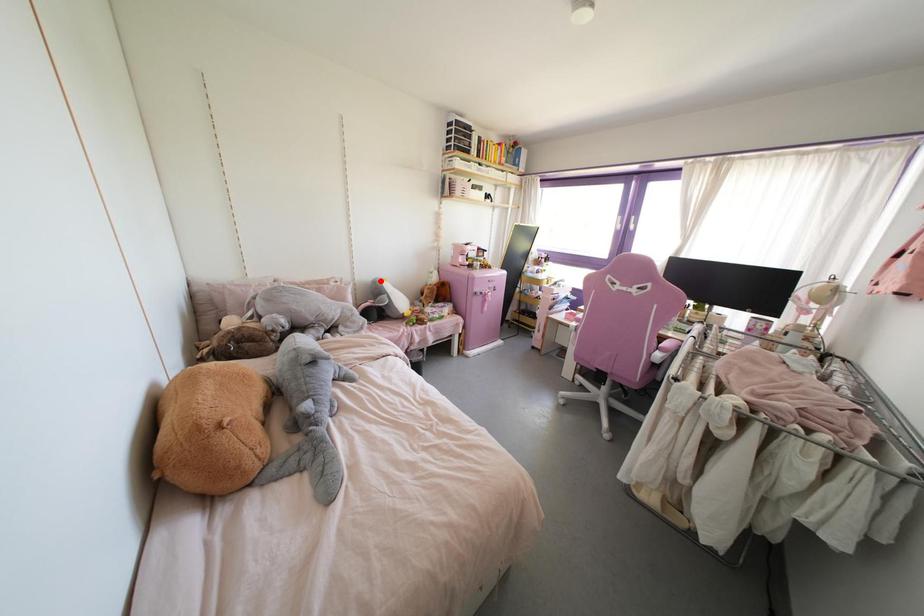
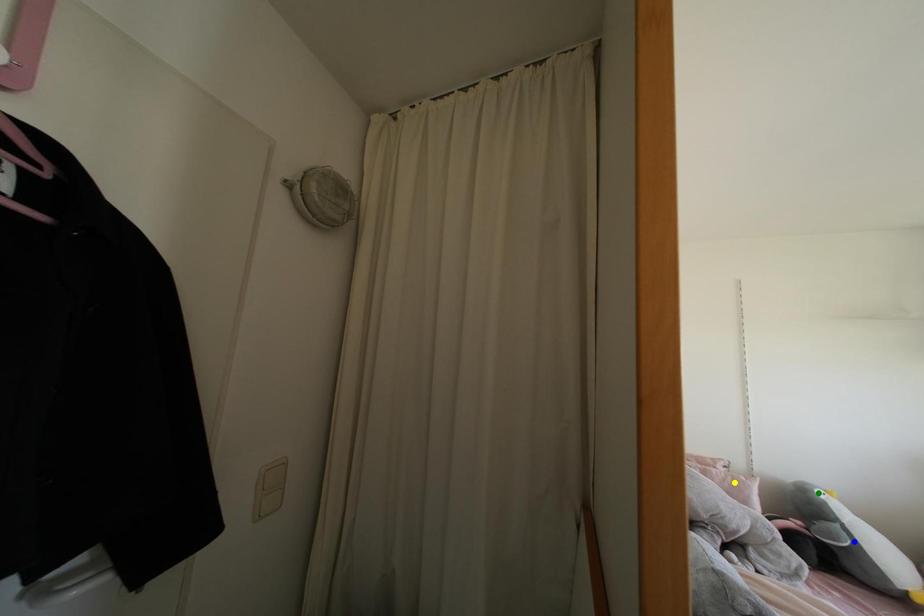
Question: I am providing you with two images of the same scene from different viewpoints. A red point is marked on the first image. You are given multiple points on the second image. Which spot in image 2 lines up with the point in image 1?

Choices:
 (A) green point
 (B) blue point
 (C) yellow point

Answer: (A)